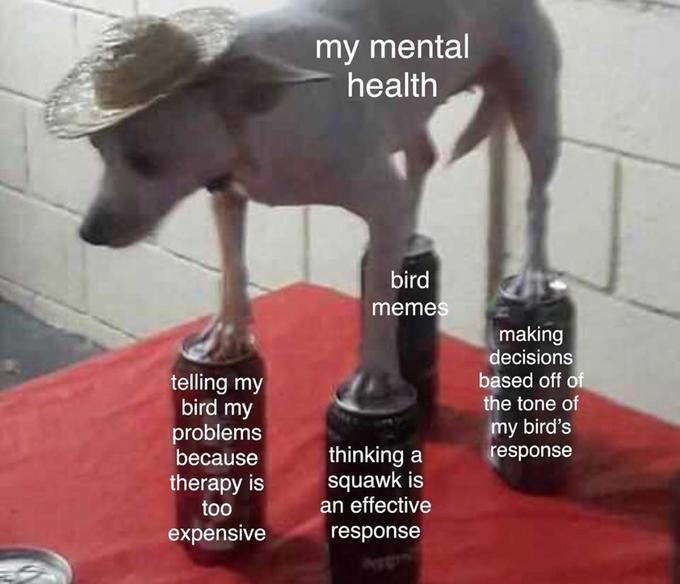
Image resolution: width=680 pixels, height=584 pixels. In order to click on grey floor in this screenshot , I will do `click(48, 342)`.